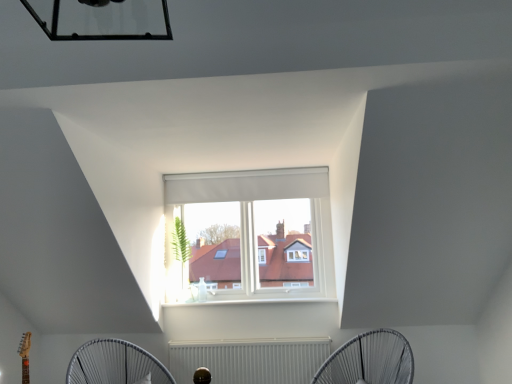
This screenshot has width=512, height=384. I want to click on vacant area on top of white textured radiator at lower center (from a real-world perspective), so (249, 332).